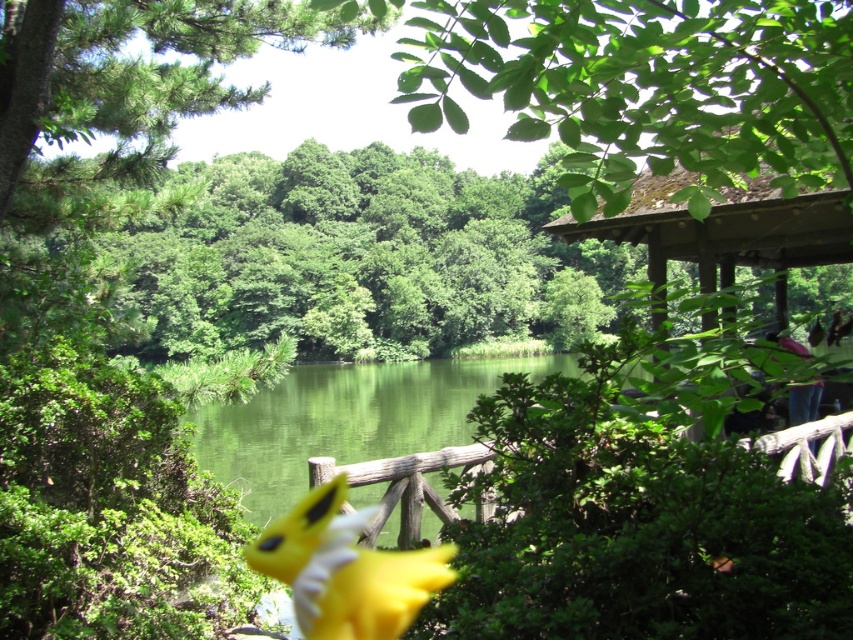
Between green leafy tree at upper left and yellow plush toy at center, which one appears on the left side from the viewer's perspective?

green leafy tree at upper left is more to the left.

Does point (68, 4) come closer to viewer compared to point (430, 593)?

No.

This screenshot has height=640, width=853. What are the coordinates of `green leafy tree at upper left` in the screenshot? It's located at (132, 67).